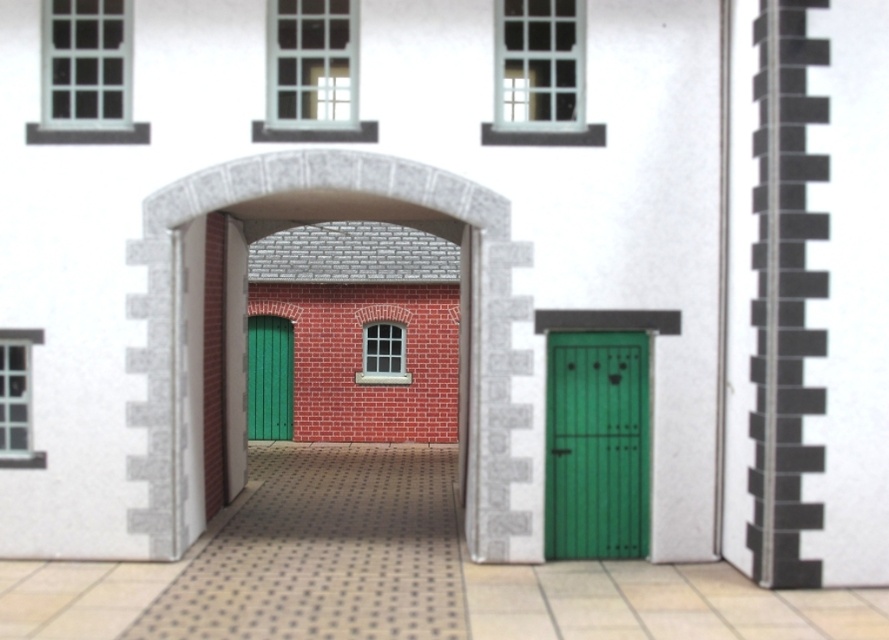
You are an architect examining this miniature model. You need to determine the spatial relationship between the brick textured archway at center and the green wooden door at center. Which one is positioned higher in the scene?

The brick textured archway at center is above the green wooden door at center, so it is positioned higher in the scene.